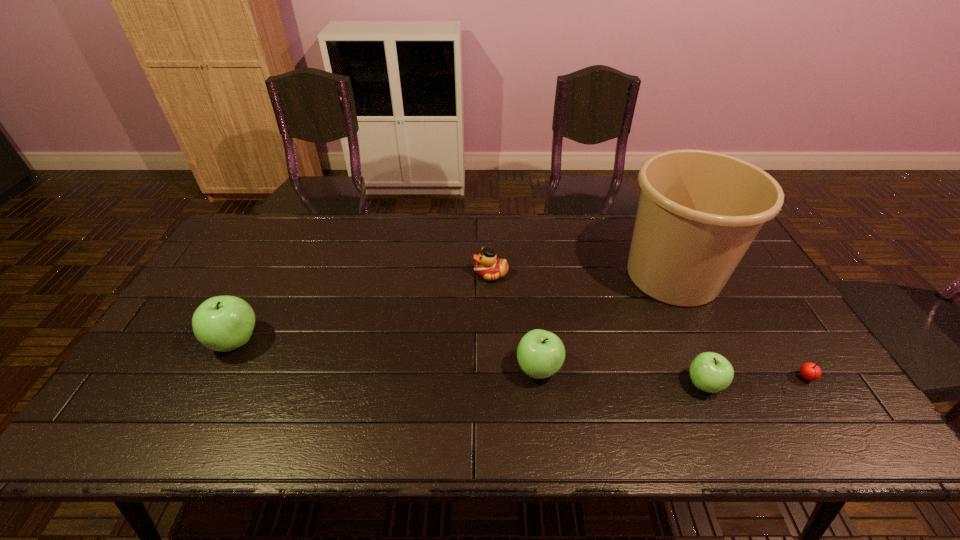
Where is `blank region between the fifth object from right to left and the rightmost apple`? This screenshot has height=540, width=960. blank region between the fifth object from right to left and the rightmost apple is located at coordinates (597, 329).

This screenshot has width=960, height=540. I want to click on vacant point located between the rightmost apple and the cherry, so click(x=756, y=382).

This screenshot has height=540, width=960. Identify the location of vacant space that is in between the rightmost object and the fifth object from right to left. (649, 326).

The width and height of the screenshot is (960, 540). Find the location of `free point between the fourth object from right to left and the second tallest object`. free point between the fourth object from right to left and the second tallest object is located at coordinates (387, 355).

Locate an element on the screen. This screenshot has width=960, height=540. empty location between the rightmost apple and the tallest object is located at coordinates (688, 330).

Where is `free area in between the shortest apple and the second tallest apple`? free area in between the shortest apple and the second tallest apple is located at coordinates (621, 376).

The height and width of the screenshot is (540, 960). Find the location of `vacant space in between the tallest object and the second apple from left to right`. vacant space in between the tallest object and the second apple from left to right is located at coordinates (606, 322).

Identify which object is the fourth nearest to the shortest apple. Please provide its 2D coordinates. Your answer should be formatted as a tuple, i.e. [(x, y)], where the tuple contains the x and y coordinates of a point satisfying the conditions above.

[(488, 266)]

Locate an element on the screen. object that stands as the second closest to the second shortest apple is located at coordinates (488, 266).

Identify which apple is located as the nearest to the tallest apple. Please provide its 2D coordinates. Your answer should be formatted as a tuple, i.e. [(x, y)], where the tuple contains the x and y coordinates of a point satisfying the conditions above.

[(540, 353)]